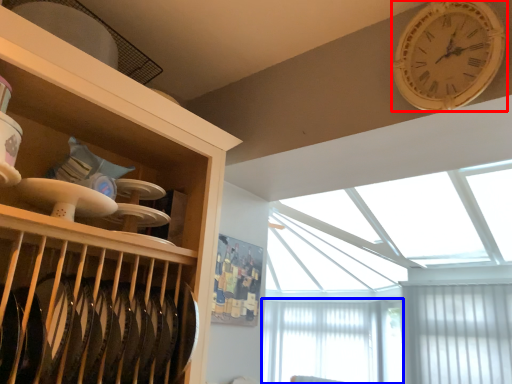
Question: Which object is further to the camera taking this photo, wall clock (highlighted by a red box) or window screen (highlighted by a blue box)?

Choices:
 (A) wall clock
 (B) window screen

Answer: (B)